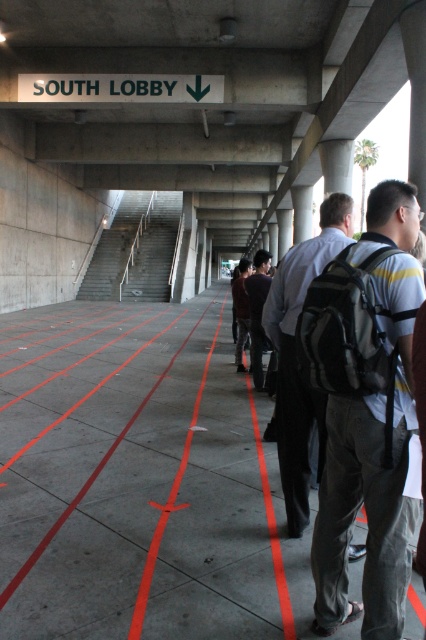
Question: Does matte black backpack at right lie in front of black fabric pants at center?

Choices:
 (A) no
 (B) yes

Answer: (A)

Question: Can you confirm if concrete floor at center is wider than black fabric pants at center?

Choices:
 (A) no
 (B) yes

Answer: (B)

Question: Can you confirm if orange painted line at center is positioned to the right of black fabric pants at center?

Choices:
 (A) no
 (B) yes

Answer: (A)

Question: Which of these objects is positioned closest to the dark gray backpack at center?

Choices:
 (A) orange painted line at center
 (B) black fabric pants at center

Answer: (A)

Question: Which object is the closest to the matte black backpack at right?

Choices:
 (A) black fabric pants at center
 (B) gray fabric backpack at right
 (C) dark gray backpack at center
 (D) orange painted line at center

Answer: (B)

Question: Which object is the farthest from the matte black backpack at right?

Choices:
 (A) concrete floor at center
 (B) dark gray backpack at center
 (C) black fabric pants at center
 (D) orange painted line at center

Answer: (A)